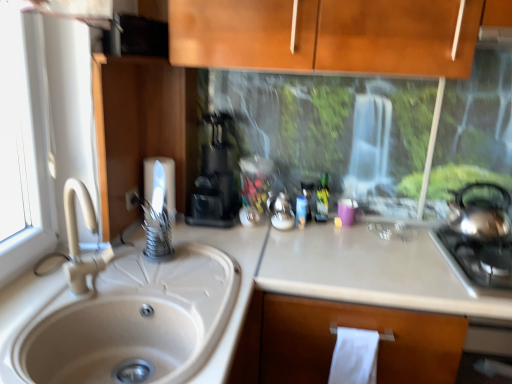
Question: Would you say white matte countertop at center is to the left or to the right of white matte sink at left in the picture?

Choices:
 (A) right
 (B) left

Answer: (A)

Question: Is point (357, 274) positioned closer to the camera than point (74, 288)?

Choices:
 (A) farther
 (B) closer

Answer: (A)

Question: Which object is the farthest from the metallic silver kettle at center?

Choices:
 (A) white paper towel at lower center, which is counted as the second toilet paper, starting from the left
 (B) white matte toilet paper at upper left, which appears as the second toilet paper when ordered from the bottom
 (C) white matte countertop at center
 (D) stainless steel gas stove at right
 (E) white matte sink at left

Answer: (E)

Question: Estimate the real-world distances between objects in this image. Which object is closer to the white matte countertop at center?

Choices:
 (A) metallic silver kettle at center
 (B) green matte bottle at center
 (C) black plastic coffee machine at center
 (D) white matte toilet paper at upper left, marked as the first toilet paper in a top-to-bottom arrangement
 (E) stainless steel gas stove at right

Answer: (E)